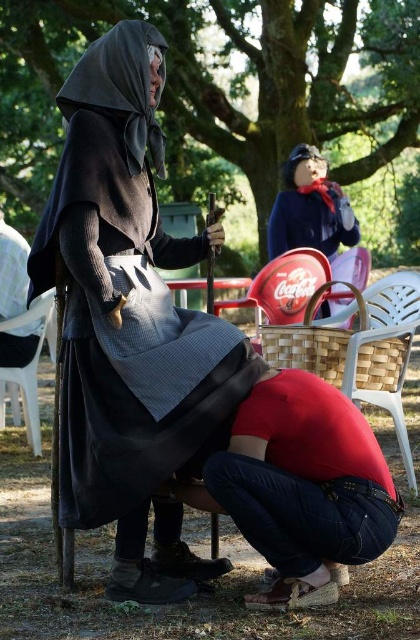
Question: Does matte black cape at center have a lesser width compared to matte blue dress at upper center?

Choices:
 (A) yes
 (B) no

Answer: (B)

Question: Which point is farther to the camera?

Choices:
 (A) matte black cape at center
 (B) white plastic chair at lower left
 (C) matte blue dress at upper center
 (D) woven wood chair at center

Answer: (C)

Question: Is matte blue dress at upper center below white plastic chair at lower left?

Choices:
 (A) yes
 (B) no

Answer: (B)

Question: Considering the real-world distances, which object is farthest from the woven wood chair at center?

Choices:
 (A) white plastic chair at lower left
 (B) matte black cape at center

Answer: (A)

Question: Which object is farther from the camera taking this photo?

Choices:
 (A) matte blue dress at upper center
 (B) white plastic chair at lower left

Answer: (A)

Question: Is matte black cape at center wider than woven wood chair at center?

Choices:
 (A) yes
 (B) no

Answer: (A)